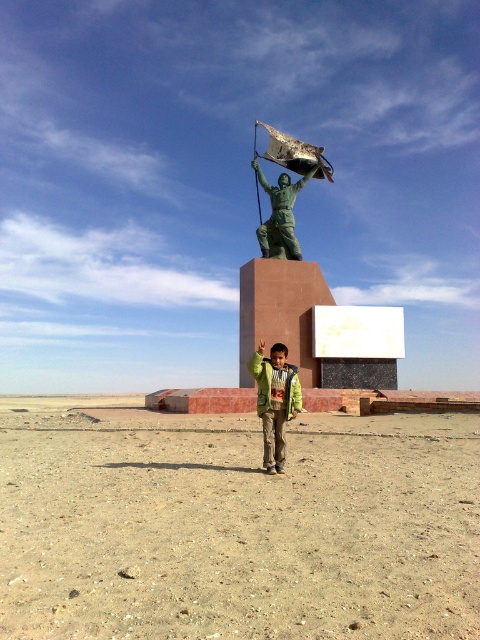
You are a desert explorer who needs to place a new flagpole exactly halfway between the dull brown dirt at center and the bronze statue at center. Which object will the flagpole be closer to?

The flagpole will be closer to the dull brown dirt at center because the dull brown dirt at center is shorter than the bronze statue at center, so the halfway point would be closer to the shorter object.

You are a photographer trying to capture the boy in the desert. You want to ensure the green matte jacket at center is visible in the frame. Should you position yourself to the right or left of the dull brown dirt at center to achieve this?

You should position yourself to the right of the dull brown dirt at center. Since the dull brown dirt at center is to the left of the green matte jacket at center, moving to the right side of the dull brown dirt at center will keep the green matte jacket at center in your view.

What is the location of the point with coordinates [285,189] in the image?

The point with coordinates [285,189] is located on the bronze statue at center.